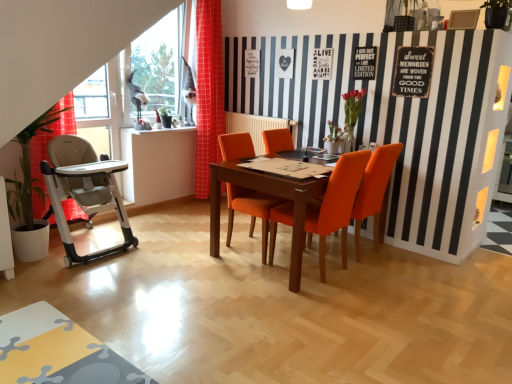
The height and width of the screenshot is (384, 512). What are the coordinates of `vacant region to the right of orange fabric chair at center, which ranks as the 2th chair in right-to-left order` in the screenshot? It's located at [386, 276].